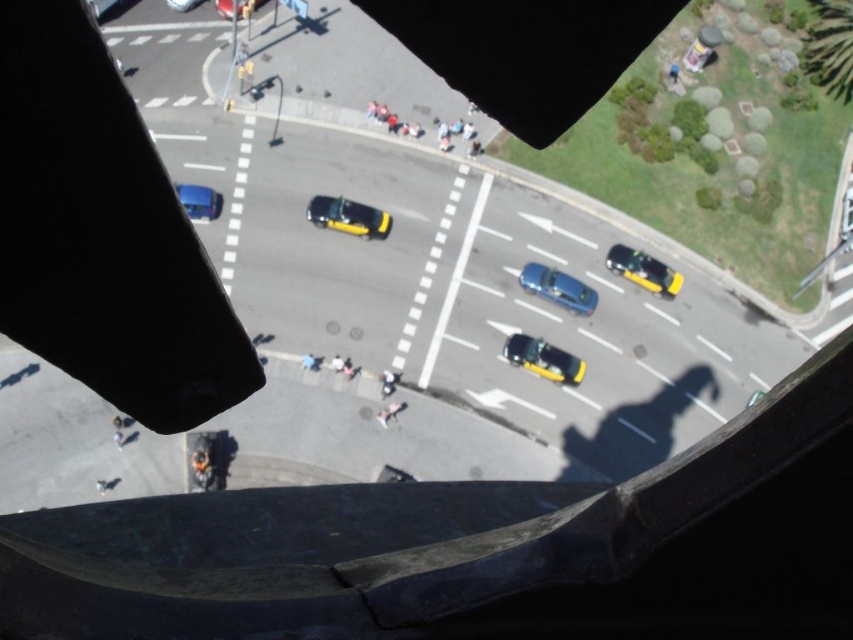
Who is positioned more to the left, shiny black taxi at center or metallic blue car at upper left?

metallic blue car at upper left

Who is more forward, [558,364] or [177,184]?

Positioned in front is point [558,364].

Where is `shiny black taxi at center`? Image resolution: width=853 pixels, height=640 pixels. shiny black taxi at center is located at coordinates (543, 358).

Which of these two, shiny black taxi at center or smooth skin person at center, stands taller?

Standing taller between the two is shiny black taxi at center.

This screenshot has width=853, height=640. What do you see at coordinates (543, 358) in the screenshot?
I see `shiny black taxi at center` at bounding box center [543, 358].

Which is in front, point (579, 371) or point (386, 426)?

Point (386, 426) is in front.

In order to click on shiny black taxi at center in this screenshot , I will do `click(543, 358)`.

Does shiny black taxi at center have a larger size compared to yellow and black taxi at center?

Actually, shiny black taxi at center might be smaller than yellow and black taxi at center.

Is point (515, 349) closer to viewer compared to point (379, 221)?

Yes, it is.

Identify the location of shiny black taxi at center. (543, 358).